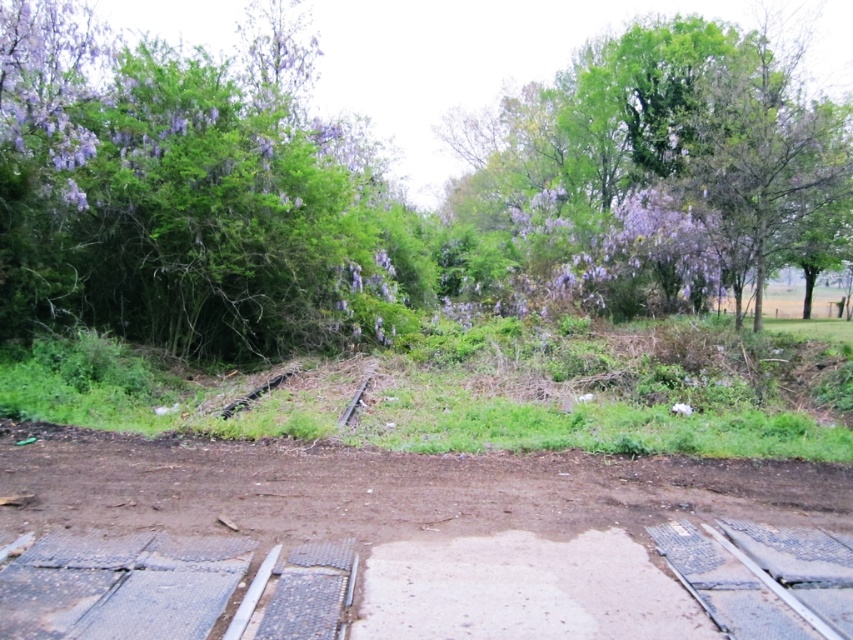
Can you confirm if purple leafy bush at upper left is smaller than purple leafy tree at upper left?

Yes, purple leafy bush at upper left is smaller than purple leafy tree at upper left.

Between purple leafy bush at upper left and purple leafy tree at upper left, which one appears on the left side from the viewer's perspective?

From the viewer's perspective, purple leafy bush at upper left appears more on the left side.

You are a GUI agent. You are given a task and a screenshot of the screen. Output one action in this format:
    pyautogui.click(x=<x>, y=<y>)
    Task: Click on the purple leafy bush at upper left
    The height and width of the screenshot is (640, 853).
    Given the screenshot: What is the action you would take?
    pyautogui.click(x=181, y=195)

Is green leafy tree at upper left to the right of brown dirt track at center from the viewer's perspective?

In fact, green leafy tree at upper left is to the left of brown dirt track at center.

Does green leafy tree at upper left appear over brown dirt track at center?

Indeed, green leafy tree at upper left is positioned over brown dirt track at center.

This screenshot has width=853, height=640. What do you see at coordinates (370, 177) in the screenshot?
I see `green leafy tree at upper left` at bounding box center [370, 177].

The width and height of the screenshot is (853, 640). I want to click on green leafy tree at upper left, so click(x=370, y=177).

Which is more to the left, brown dirt track at center or purple leafy tree at upper left?

From the viewer's perspective, brown dirt track at center appears more on the left side.

Does brown dirt track at center have a larger size compared to purple leafy tree at upper left?

Incorrect, brown dirt track at center is not larger than purple leafy tree at upper left.

Who is more distant from viewer, (x=202, y=452) or (x=671, y=19)?

The point (x=671, y=19) is behind.

Where is `brown dirt track at center`? The image size is (853, 640). brown dirt track at center is located at coordinates (412, 545).